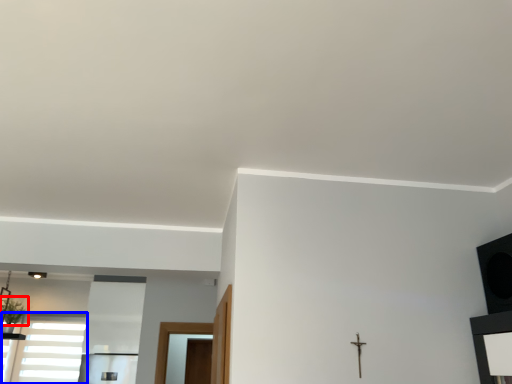
Question: Which point is further to the camera, plant (highlighted by a red box) or window (highlighted by a blue box)?

Choices:
 (A) plant
 (B) window

Answer: (B)